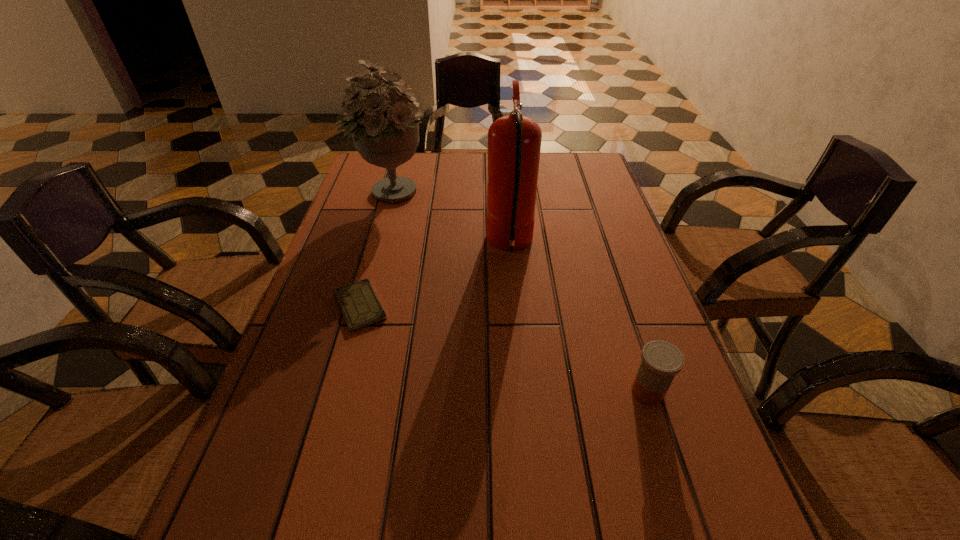
Locate an element on the screen. The image size is (960, 540). vacant space at the far edge of the desktop is located at coordinates (430, 179).

Identify the location of blank space at the left edge of the desktop. Image resolution: width=960 pixels, height=540 pixels. (354, 245).

This screenshot has height=540, width=960. In the image, there is a desktop. In order to click on vacant space at the right edge in this screenshot , I will do point(674,395).

Identify the location of vacant space at the far right corner of the desktop. (602, 184).

Where is `vacant region between the third farthest object and the rightmost object`? vacant region between the third farthest object and the rightmost object is located at coordinates (504, 349).

You are a GUI agent. You are given a task and a screenshot of the screen. Output one action in this format:
    pyautogui.click(x=<x>, y=<y>)
    Task: Click on the free space between the second shortest object and the shortest object
    Image resolution: width=960 pixels, height=540 pixels.
    Given the screenshot: What is the action you would take?
    pyautogui.click(x=504, y=349)

The height and width of the screenshot is (540, 960). In order to click on unoccupied area between the third farthest object and the fire extinguisher in this screenshot , I will do `click(435, 275)`.

Locate an element on the screen. The height and width of the screenshot is (540, 960). unoccupied area between the farthest object and the shortest object is located at coordinates pyautogui.click(x=375, y=250).

Where is `free spot between the third nearest object and the shortest object`? free spot between the third nearest object and the shortest object is located at coordinates (435, 275).

This screenshot has height=540, width=960. Identify the location of vacant point located between the third tallest object and the bouquet. (519, 293).